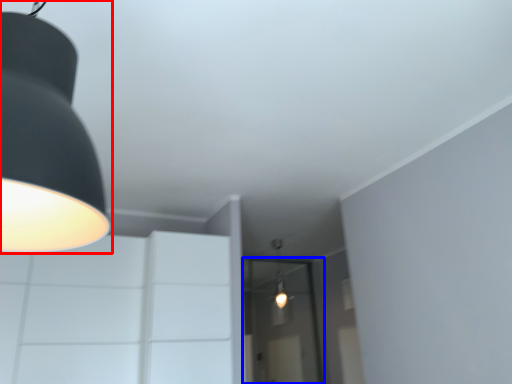
Question: Which object is closer to the camera taking this photo, lamp (highlighted by a red box) or glass door (highlighted by a blue box)?

Choices:
 (A) lamp
 (B) glass door

Answer: (A)